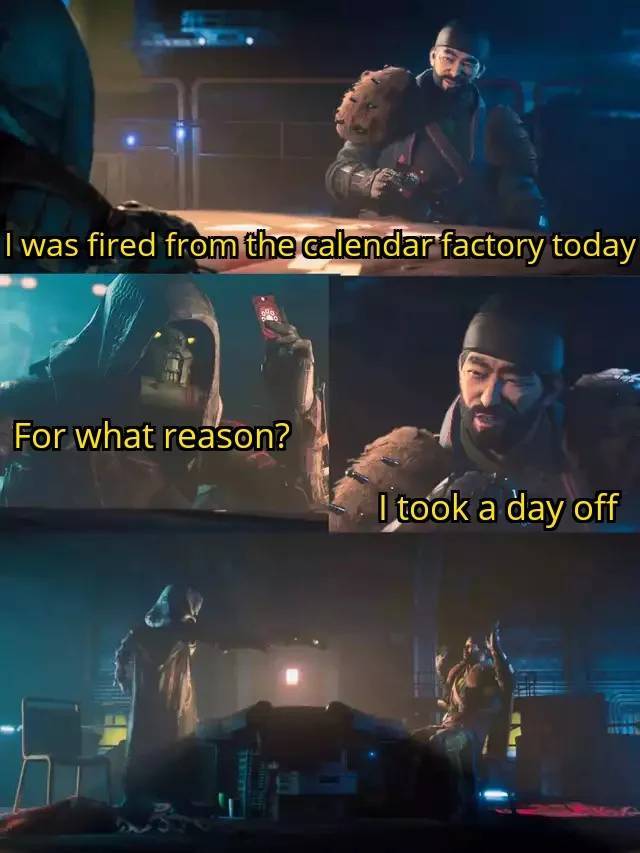
Where is `hood`? The height and width of the screenshot is (853, 640). hood is located at coordinates (154, 297).